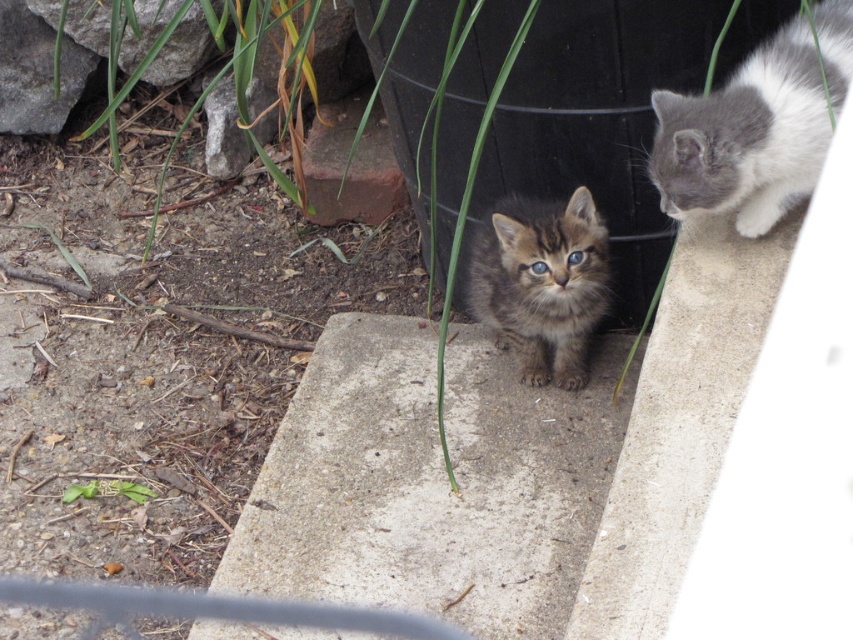
The image size is (853, 640). In order to click on tabby fur kitten at center in this screenshot , I will do `click(541, 282)`.

Does point (473, 308) lie in front of point (99, 493)?

No, (473, 308) is behind (99, 493).

Describe the element at coordinates (541, 282) in the screenshot. The image size is (853, 640). I see `tabby fur kitten at center` at that location.

Find the location of a particular element. tabby fur kitten at center is located at coordinates (541, 282).

Is tabby fur kitten at center below green leafy plant at center?

Indeed, tabby fur kitten at center is positioned under green leafy plant at center.

Does point (572, 230) lie in front of point (438, 81)?

That is True.

You are a GUI agent. You are given a task and a screenshot of the screen. Output one action in this format:
    pyautogui.click(x=<x>, y=<y>)
    Task: Click on the tabby fur kitten at center
    
    Given the screenshot: What is the action you would take?
    pyautogui.click(x=541, y=282)

Looking at this image, between green leafy plant at center and green leafy plant at lower left, which one has less height?

Standing shorter between the two is green leafy plant at lower left.

Is green leafy plant at center positioned in front of green leafy plant at lower left?

Yes, it is in front of green leafy plant at lower left.

Locate an element on the screen. This screenshot has height=640, width=853. green leafy plant at center is located at coordinates (465, 220).